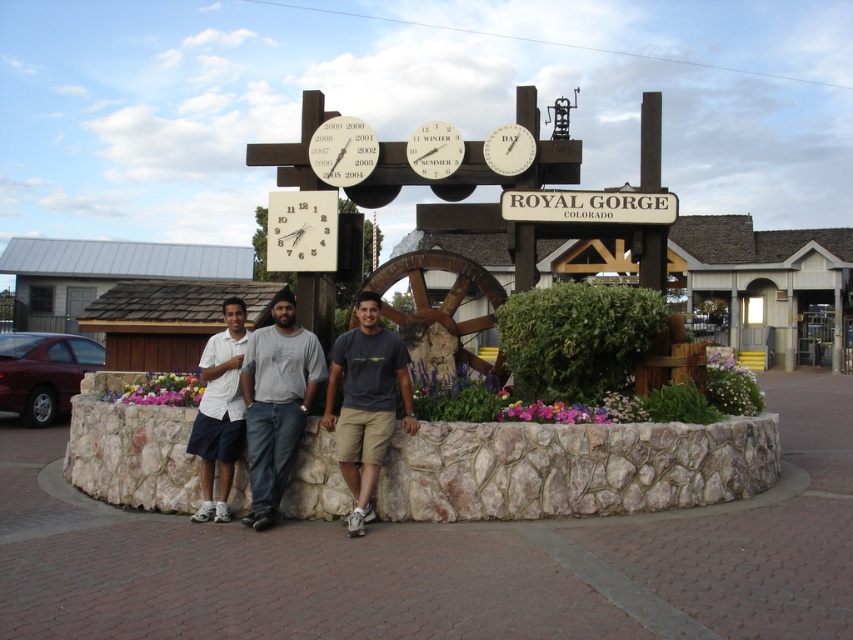
You are a photographer trying to capture a clear photo of the denim jeans at center and the white cotton shirt at center. Since you want both items to appear equally prominent in the photo, which one should you zoom in on more?

The denim jeans at center is bigger than the white cotton shirt at center, so you should zoom in more on the white cotton shirt at center to make both appear equally prominent in the photo.

You are a photographer standing at the entrance of Royal Gorge, Colorado, where you see the white cotton shirt at center and the matte white clock at upper center. You want to take a photo that includes both subjects. Given that your camera has a maximum focus range of 4 meters, will you be able to capture both subjects in focus at the same time?

The white cotton shirt at center and the matte white clock at upper center are 4.08 meters apart from each other. Since the camera can only focus within 4 meters, the distance between them exceeds the maximum focus range. Therefore, you cannot capture both subjects in focus simultaneously.

You are a photographer trying to capture a clear photo of the white plastic clock at center without the light gray cotton shirt at center blocking it. What should you do?

The light gray cotton shirt at center is larger in size than the white plastic clock at center, so you should move the camera position to the side to avoid the shirt blocking the clock.